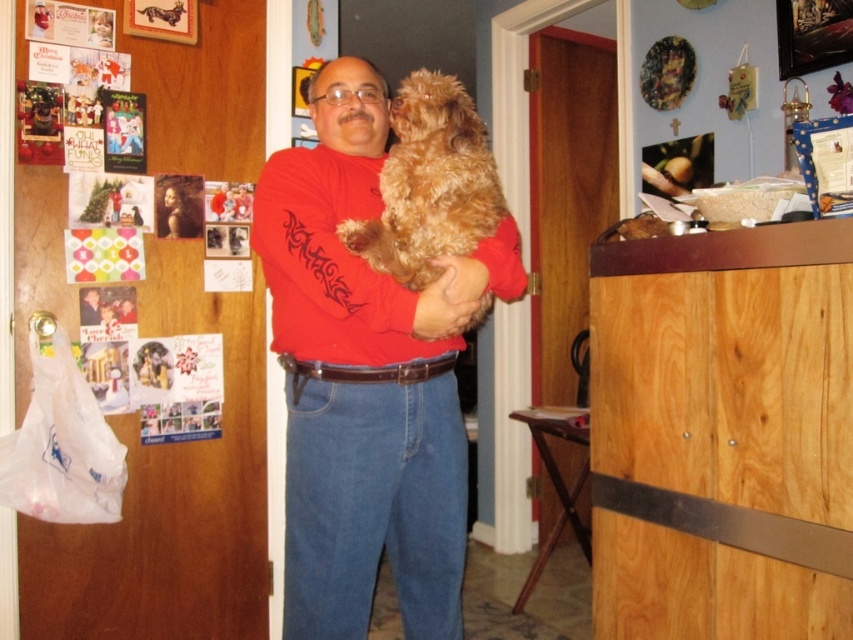
Question: Among these points, which one is nearest to the camera?

Choices:
 (A) (467, 97)
 (B) (294, 381)

Answer: (A)

Question: Is matte red shirt at center behind fuzzy brown dog at center?

Choices:
 (A) no
 (B) yes

Answer: (A)

Question: Is matte red shirt at center to the right of fuzzy brown dog at center from the viewer's perspective?

Choices:
 (A) yes
 (B) no

Answer: (B)

Question: Can you confirm if matte red shirt at center is smaller than fuzzy brown dog at center?

Choices:
 (A) yes
 (B) no

Answer: (B)